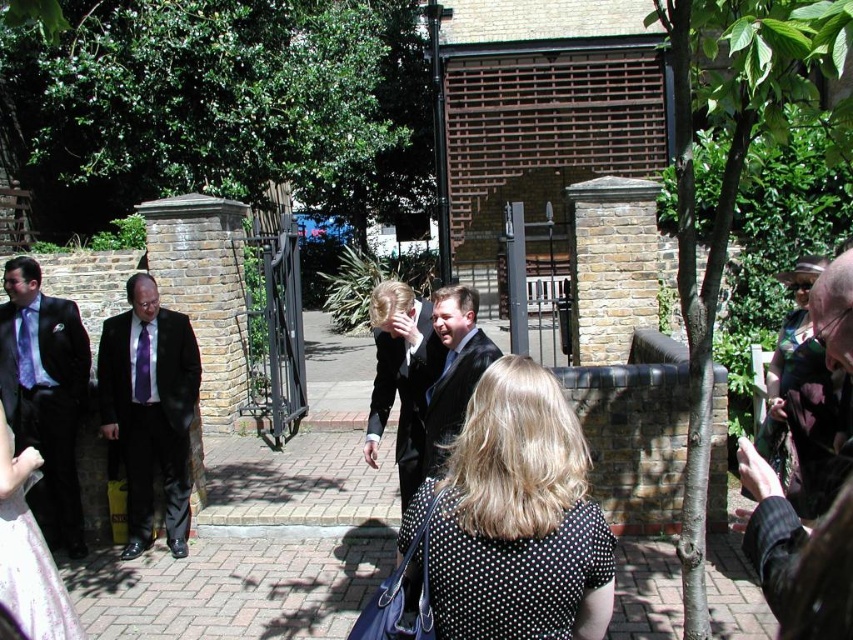
Who is higher up, matte black suit at left or light blue silk tie at left?

light blue silk tie at left

The image size is (853, 640). What are the coordinates of `matte black suit at left` in the screenshot? It's located at (149, 410).

Locate an element on the screen. This screenshot has height=640, width=853. silvery sequined dress at lower left is located at coordinates (28, 552).

Which of these two, silvery sequined dress at lower left or purple satin tie at left, stands shorter?

Standing shorter between the two is purple satin tie at left.

This screenshot has width=853, height=640. Describe the element at coordinates (28, 552) in the screenshot. I see `silvery sequined dress at lower left` at that location.

Locate an element on the screen. This screenshot has width=853, height=640. silvery sequined dress at lower left is located at coordinates (28, 552).

This screenshot has height=640, width=853. What are the coordinates of `black dotted dress at center` in the screenshot? It's located at (515, 516).

The height and width of the screenshot is (640, 853). Identify the location of black dotted dress at center. (515, 516).

You are a GUI agent. You are given a task and a screenshot of the screen. Output one action in this format:
    pyautogui.click(x=<x>, y=<y>)
    Task: Click on the black dotted dress at center
    The width and height of the screenshot is (853, 640).
    Given the screenshot: What is the action you would take?
    pyautogui.click(x=515, y=516)